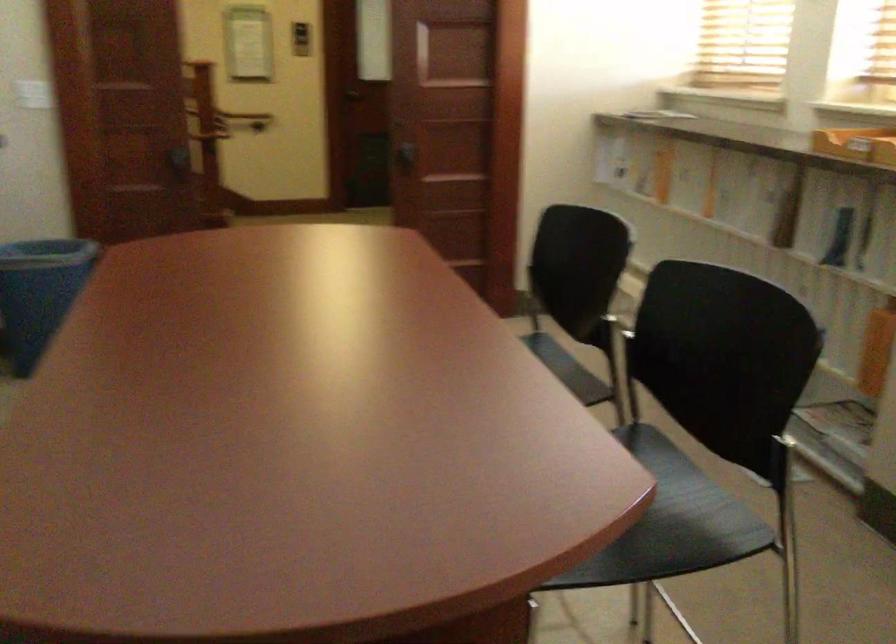
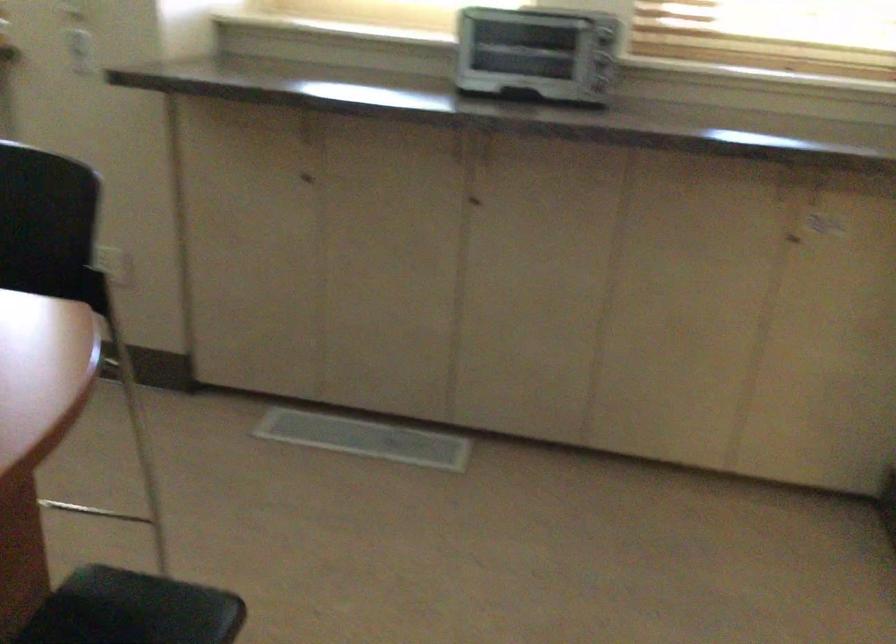
Based on the continuous images, in which direction is the camera rotating?

The rotation direction of the camera is right-down.